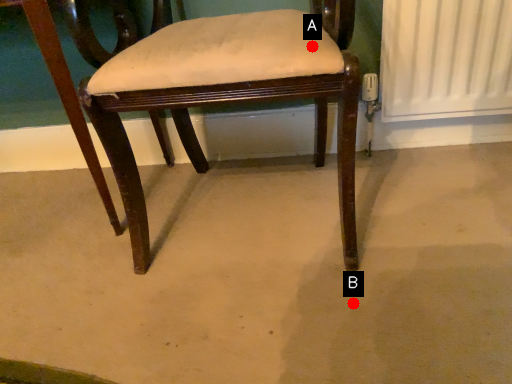
Question: Two points are circled on the image, labeled by A and B beside each circle. Which of the following is the closest to the observer?

Choices:
 (A) A is closer
 (B) B is closer

Answer: (A)